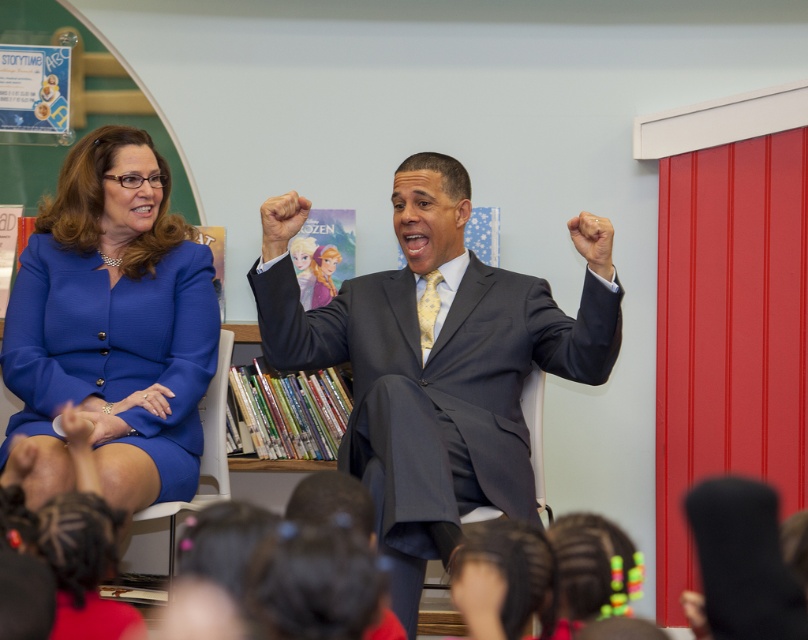
Please look at the image and locate the point at coordinates (432, 364). What object is exactly at that point?

The point at coordinates (432, 364) marks the matte gray suit at center.

You are an interior designer working on a layout for a library. You need to place a new bookshelf at point A and a reading corner at point B. According to the image, where should you place the bookshelf and reading corner to ensure they are not overlapping with the blue fabric dress at left? Please provide coordinates for points A and B.

The blue fabric dress at left is located at point (112, 326). To avoid overlapping, place the bookshelf at point A away from this coordinate, such as (161, 192), and the reading corner at point B at (242, 448).